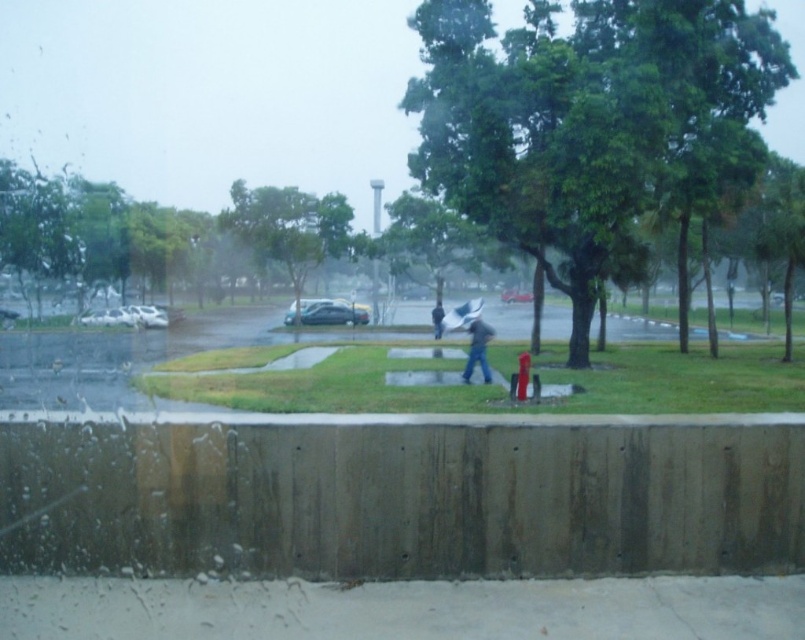
Can you confirm if dark gray fabric jacket at center is bigger than transparent plastic umbrella at center?

Actually, dark gray fabric jacket at center might be smaller than transparent plastic umbrella at center.

Who is taller, dark gray fabric jacket at center or transparent plastic umbrella at center?

transparent plastic umbrella at center is taller.

Is point (473, 356) positioned after point (461, 305)?

No, it is not.

Where is `dark gray fabric jacket at center`? The width and height of the screenshot is (805, 640). dark gray fabric jacket at center is located at coordinates (477, 349).

Is transparent plastic umbrella at center thinner than black matte umbrella at center?

Incorrect, transparent plastic umbrella at center's width is not less than black matte umbrella at center's.

Is point (473, 301) farther from viewer compared to point (442, 308)?

No, it is not.

Image resolution: width=805 pixels, height=640 pixels. Find the location of `transparent plastic umbrella at center`. transparent plastic umbrella at center is located at coordinates (461, 314).

Which is more to the right, dark gray fabric jacket at center or black matte umbrella at center?

From the viewer's perspective, dark gray fabric jacket at center appears more on the right side.

Does dark gray fabric jacket at center come behind black matte umbrella at center?

No, dark gray fabric jacket at center is in front of black matte umbrella at center.

Is point (473, 356) positioned after point (436, 310)?

No, it is in front of (436, 310).

At what (x,y) coordinates should I click in order to perform the action: click on dark gray fabric jacket at center. Please return your answer as a coordinate pair (x, y). Looking at the image, I should click on (477, 349).